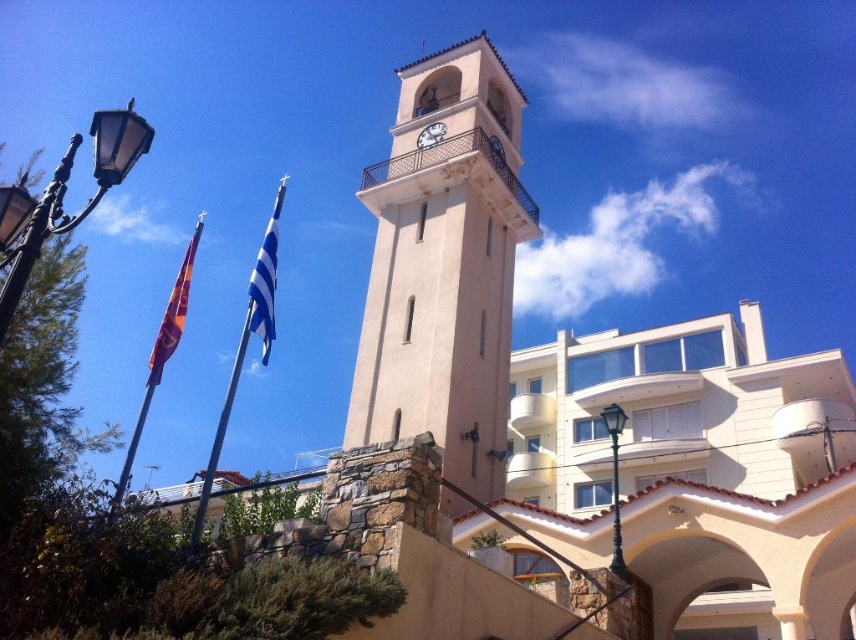
You are standing in the square facing the beige stone clock tower at center and the orange fabric flag at left. Which object is located to the left of the other?

The orange fabric flag at left is positioned to the left of the beige stone clock tower at center.